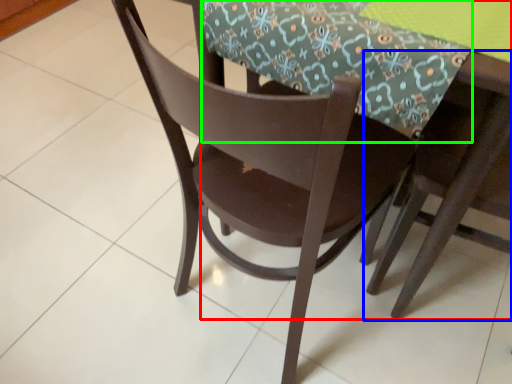
Question: Based on their relative distances, which object is nearer to round table (highlighted by a red box)? Choose from chair (highlighted by a blue box) and tablecloth (highlighted by a green box).

Choices:
 (A) chair
 (B) tablecloth

Answer: (A)